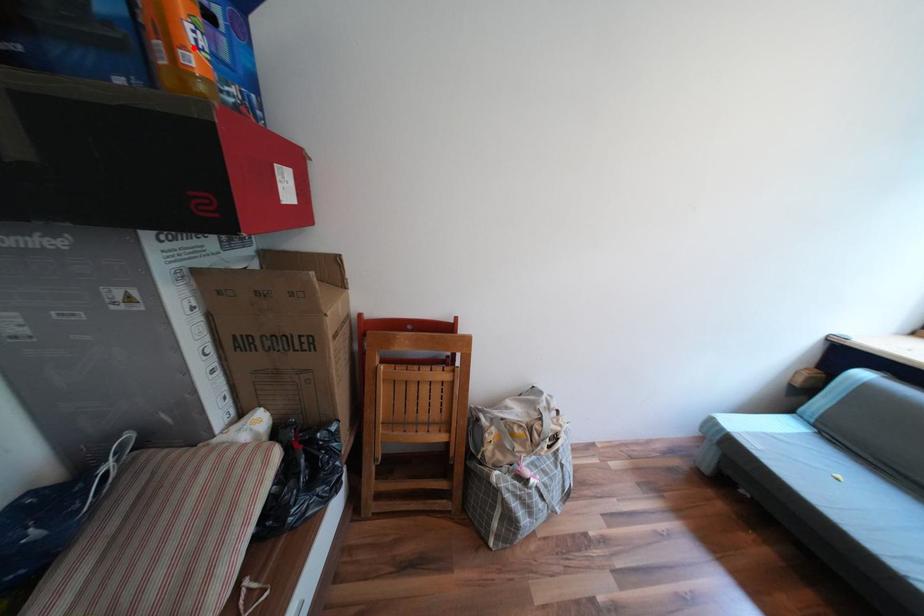
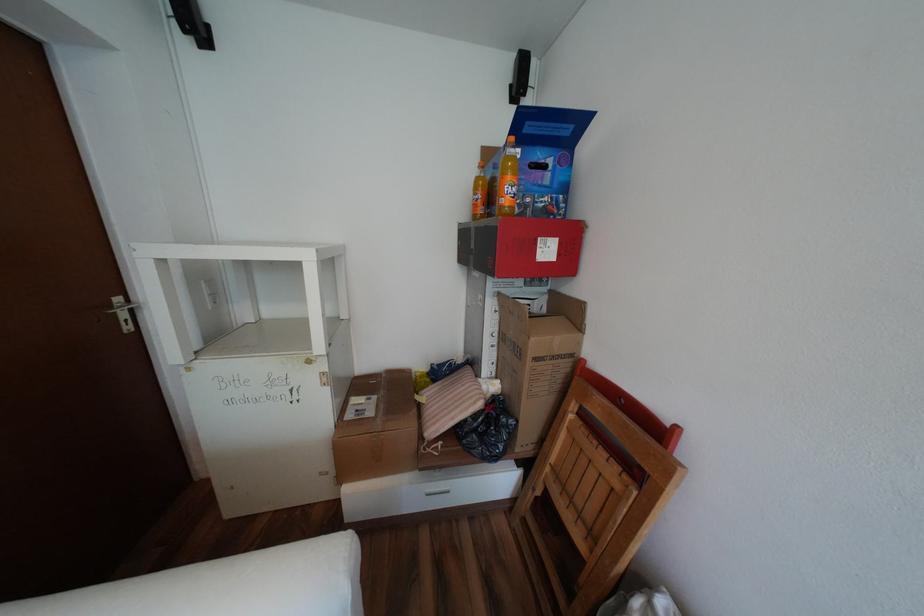
In the second image, find the point that corresponds to the highlighted location in the first image.

(512, 197)